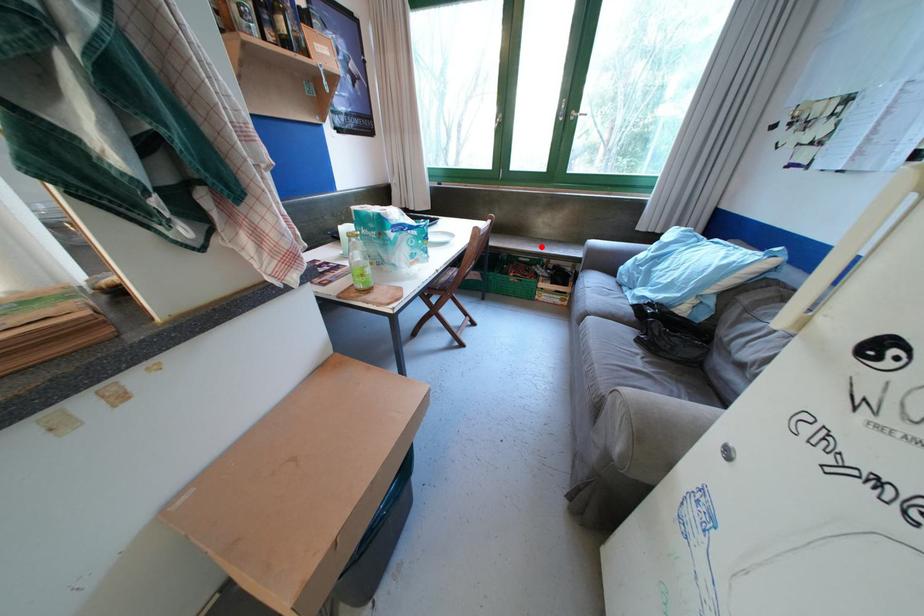
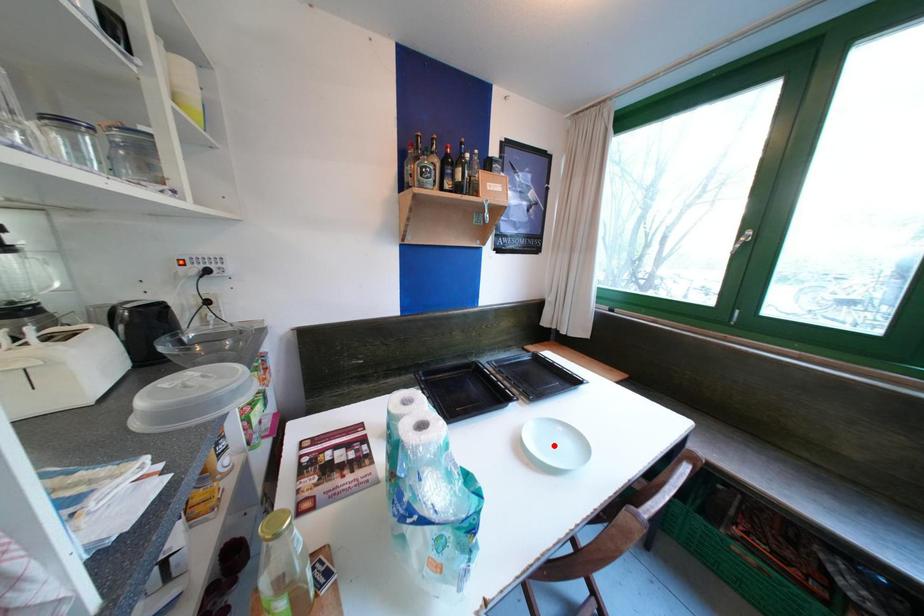
I am providing you with two images of the same scene from different viewpoints. A red point is marked on the first image and another point is marked on the second image. Is the marked point in image1 the same physical position as the marked point in image2?

No